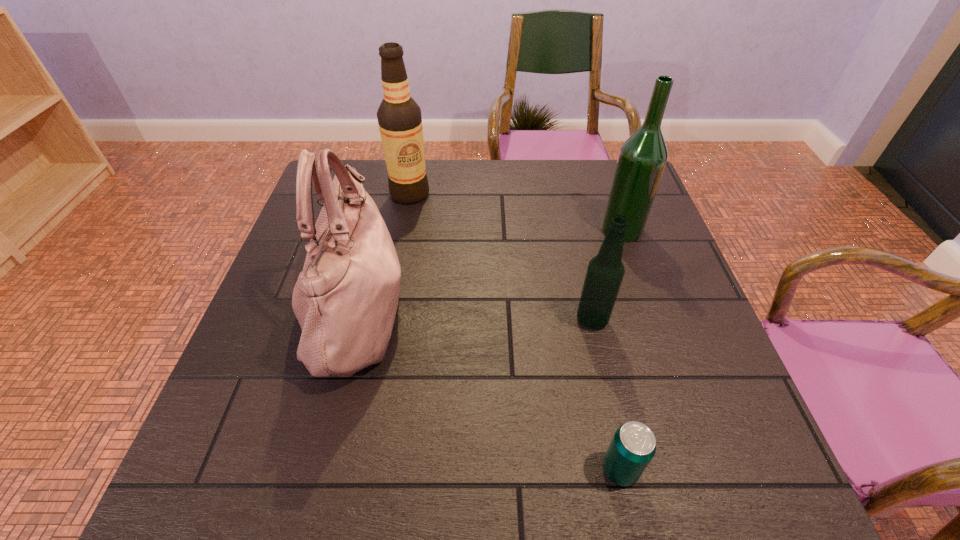
Where is `vacant position at the left edge of the desktop`? Image resolution: width=960 pixels, height=540 pixels. vacant position at the left edge of the desktop is located at coordinates (283, 364).

This screenshot has height=540, width=960. In order to click on free space at the right edge of the desktop in this screenshot , I will do (x=694, y=298).

Locate an element on the screen. Image resolution: width=960 pixels, height=540 pixels. free spot at the far left corner of the desktop is located at coordinates (372, 180).

Locate an element on the screen. vacant space at the far right corner of the desktop is located at coordinates pos(605,203).

I want to click on vacant point located between the handbag and the rightmost object, so click(x=489, y=270).

Locate an element on the screen. free point between the farthest alcohol and the fourth tallest object is located at coordinates [501, 257].

Identify the location of vacant area that lies between the fourth tallest object and the handbag. This screenshot has width=960, height=540. (474, 315).

Identify the location of empty location between the second farthest object and the nearest object. Image resolution: width=960 pixels, height=540 pixels. (621, 349).

Identify the location of vacant space that's between the nearest object and the second farthest alcohol. This screenshot has height=540, width=960. (621, 349).

Where is `vacant point located between the handbag and the second alcohol from left to right`? The width and height of the screenshot is (960, 540). vacant point located between the handbag and the second alcohol from left to right is located at coordinates (474, 315).